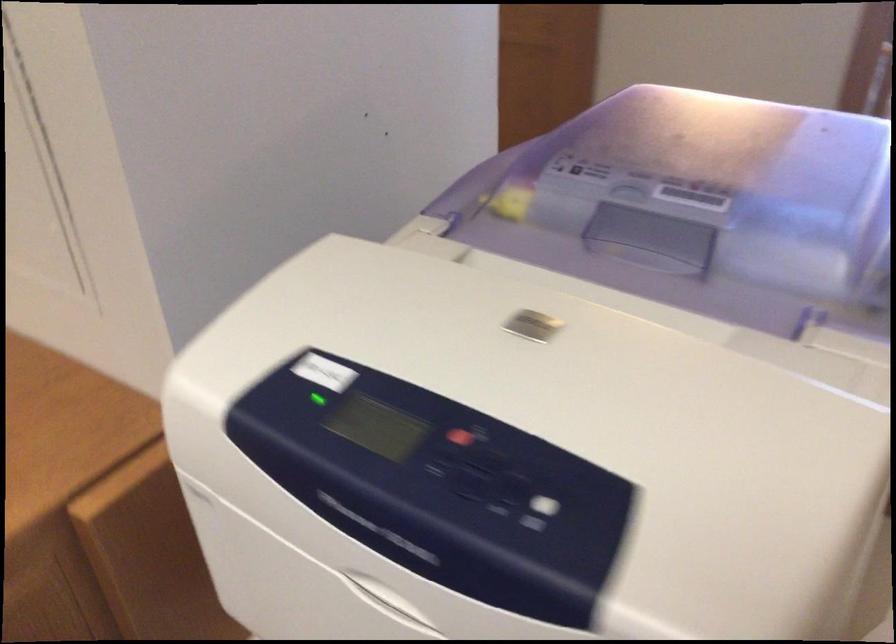
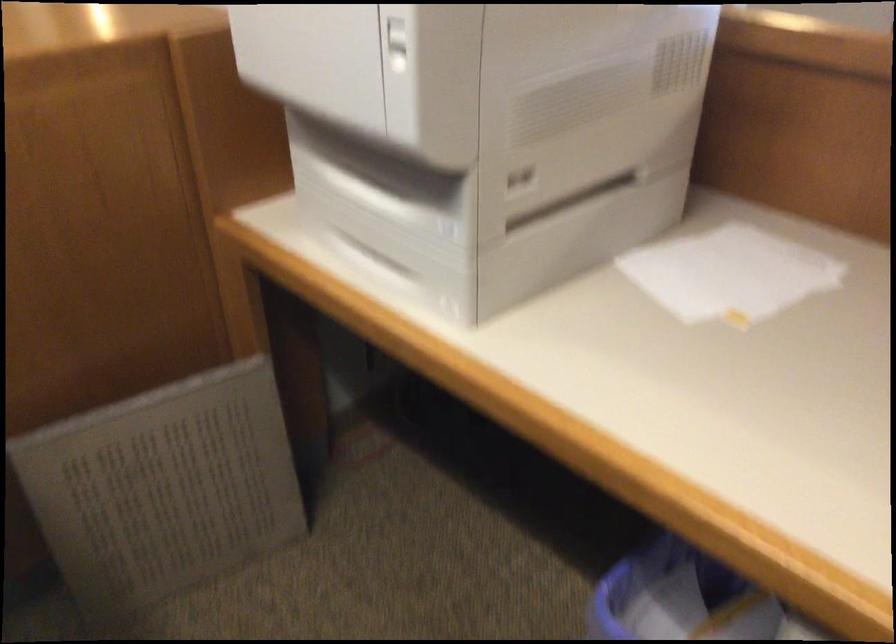
Question: The first image is from the beginning of the video and the second image is from the end. How did the camera likely rotate when shooting the video?

Choices:
 (A) Left
 (B) Right
 (C) Up
 (D) Down

Answer: (A)